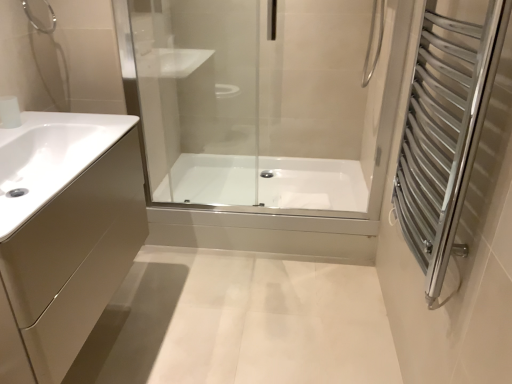
Question: From a real-world perspective, is white glossy faucet at upper left below white glossy sink at left?

Choices:
 (A) no
 (B) yes

Answer: (A)

Question: Is white glossy faucet at upper left next to white glossy sink at left and touching it?

Choices:
 (A) yes
 (B) no

Answer: (B)

Question: From the image's perspective, is white glossy faucet at upper left above white glossy sink at left?

Choices:
 (A) yes
 (B) no

Answer: (A)

Question: Does white glossy faucet at upper left have a greater width compared to white glossy sink at left?

Choices:
 (A) no
 (B) yes

Answer: (A)

Question: Considering the relative sizes of white glossy faucet at upper left and white glossy sink at left in the image provided, is white glossy faucet at upper left shorter than white glossy sink at left?

Choices:
 (A) no
 (B) yes

Answer: (B)

Question: Based on their positions, is matte beige cabinet at left located to the left or right of white glossy faucet at upper left?

Choices:
 (A) left
 (B) right

Answer: (B)

Question: From a real-world perspective, is matte beige cabinet at left positioned above or below white glossy faucet at upper left?

Choices:
 (A) above
 (B) below

Answer: (B)

Question: From the image's perspective, is matte beige cabinet at left positioned above or below white glossy faucet at upper left?

Choices:
 (A) above
 (B) below

Answer: (B)

Question: Looking at the image, does matte beige cabinet at left seem bigger or smaller compared to white glossy faucet at upper left?

Choices:
 (A) small
 (B) big

Answer: (B)

Question: Is point (431, 117) closer or farther from the camera than point (186, 201)?

Choices:
 (A) farther
 (B) closer

Answer: (B)

Question: From the image's perspective, relative to white glossy bathtub at center, is silver metallic towel rack at right above or below?

Choices:
 (A) above
 (B) below

Answer: (A)

Question: In the image, is silver metallic towel rack at right positioned in front of or behind white glossy bathtub at center?

Choices:
 (A) front
 (B) behind

Answer: (A)

Question: In terms of height, does silver metallic towel rack at right look taller or shorter compared to white glossy bathtub at center?

Choices:
 (A) tall
 (B) short

Answer: (A)

Question: Choose the correct answer: Is white glossy sink at left inside matte beige cabinet at left or outside it?

Choices:
 (A) outside
 (B) inside

Answer: (B)

Question: From a real-world perspective, is white glossy sink at left above or below matte beige cabinet at left?

Choices:
 (A) above
 (B) below

Answer: (A)